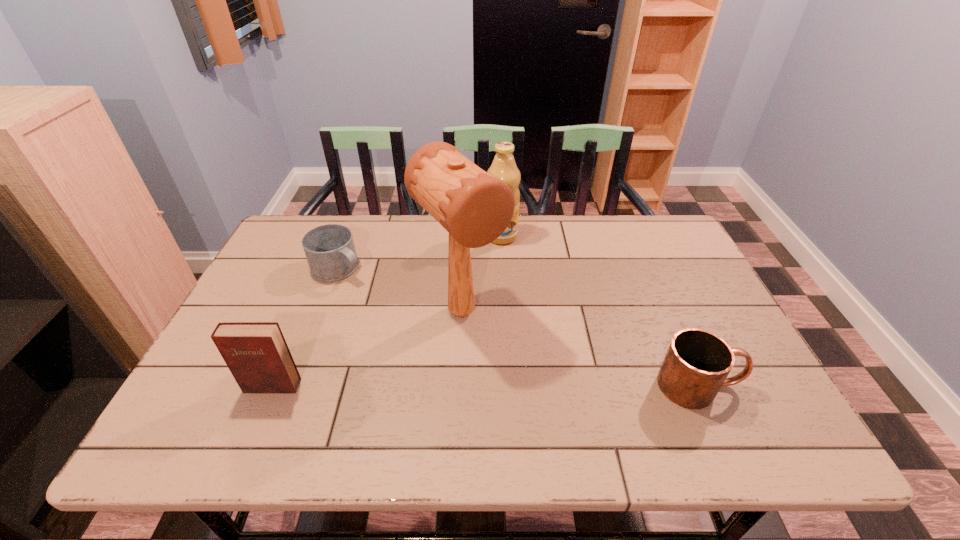
The image size is (960, 540). Identify the location of diary that is at the left edge. (256, 353).

Find the location of a particular element. mug that is positioned at the left edge is located at coordinates (330, 251).

Find the location of a particular element. object that is at the right edge is located at coordinates (697, 363).

The width and height of the screenshot is (960, 540). I want to click on object situated at the far left corner, so click(330, 251).

You are a GUI agent. You are given a task and a screenshot of the screen. Output one action in this format:
    pyautogui.click(x=<x>, y=<y>)
    Task: Click on the object present at the near left corner
    
    Given the screenshot: What is the action you would take?
    pyautogui.click(x=256, y=353)

Where is `object that is at the near right corner`? Image resolution: width=960 pixels, height=540 pixels. object that is at the near right corner is located at coordinates (697, 363).

At what (x,y) coordinates should I click in order to perform the action: click on vacant space at the far edge of the desktop. Please return your answer as a coordinate pair (x, y). The width and height of the screenshot is (960, 540). Looking at the image, I should click on (555, 220).

In the image, there is a desktop. Identify the location of vacant space at the left edge. This screenshot has width=960, height=540. (266, 280).

Find the location of a particular element. Image resolution: width=960 pixels, height=540 pixels. vacant area at the right edge is located at coordinates (687, 261).

At what (x,y) coordinates should I click in order to perform the action: click on vacant space at the far left corner of the desktop. Please return your answer as a coordinate pair (x, y). The width and height of the screenshot is (960, 540). Looking at the image, I should click on (311, 220).